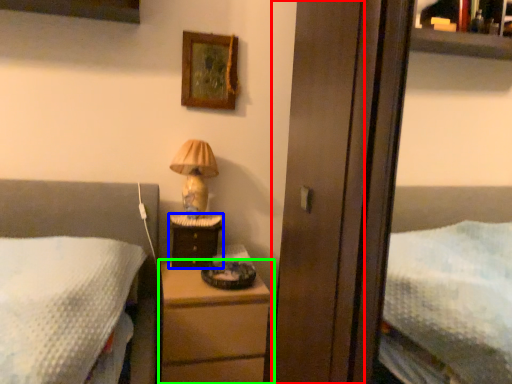
Question: Based on their relative distances, which object is nearer to screen door (highlighted by a red box)? Choose from nightstand (highlighted by a blue box) and chest of drawers (highlighted by a green box).

Choices:
 (A) nightstand
 (B) chest of drawers

Answer: (B)